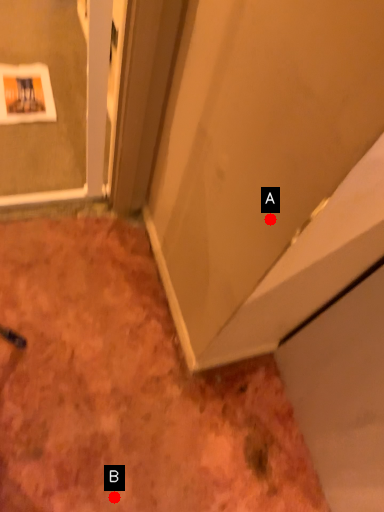
Question: Two points are circled on the image, labeled by A and B beside each circle. Which point is closer to the camera taking this photo?

Choices:
 (A) A is closer
 (B) B is closer

Answer: (A)